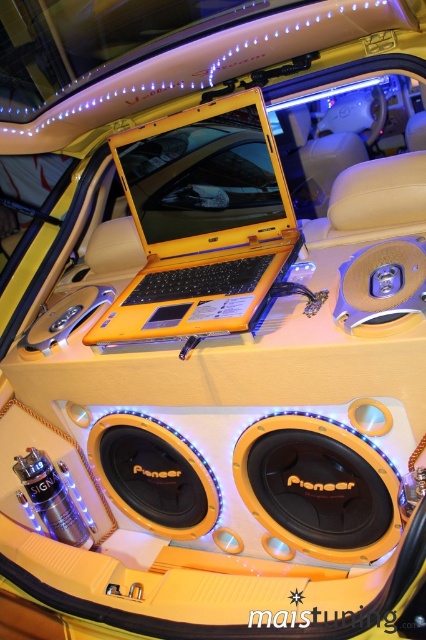
Is point (152, 449) in front of point (192, 230)?

No, it is behind (192, 230).

Between yellow matte pioneer speaker at center and yellow matte laptop at center, which one has less height?

Standing shorter between the two is yellow matte laptop at center.

What do you see at coordinates (253, 476) in the screenshot?
I see `yellow matte pioneer speaker at center` at bounding box center [253, 476].

Locate an element on the screen. yellow matte pioneer speaker at center is located at coordinates pyautogui.click(x=253, y=476).

This screenshot has height=640, width=426. In order to click on yellow matte laptop at center in this screenshot , I will do `click(201, 221)`.

Does yellow matte laptop at center have a lesser width compared to metallic gold speaker at center?

No.

Is point (172, 304) behind point (337, 316)?

Yes.

The width and height of the screenshot is (426, 640). In order to click on yellow matte laptop at center in this screenshot , I will do `click(201, 221)`.

Who is taller, yellow matte pioneer speaker at center or metallic gold speaker at center?

yellow matte pioneer speaker at center

Does yellow matte pioneer speaker at center appear under metallic gold speaker at center?

Yes.

Where is `yellow matte pioneer speaker at center`? The width and height of the screenshot is (426, 640). yellow matte pioneer speaker at center is located at coordinates (253, 476).

Locate an element on the screen. Image resolution: width=426 pixels, height=640 pixels. yellow matte pioneer speaker at center is located at coordinates (253, 476).